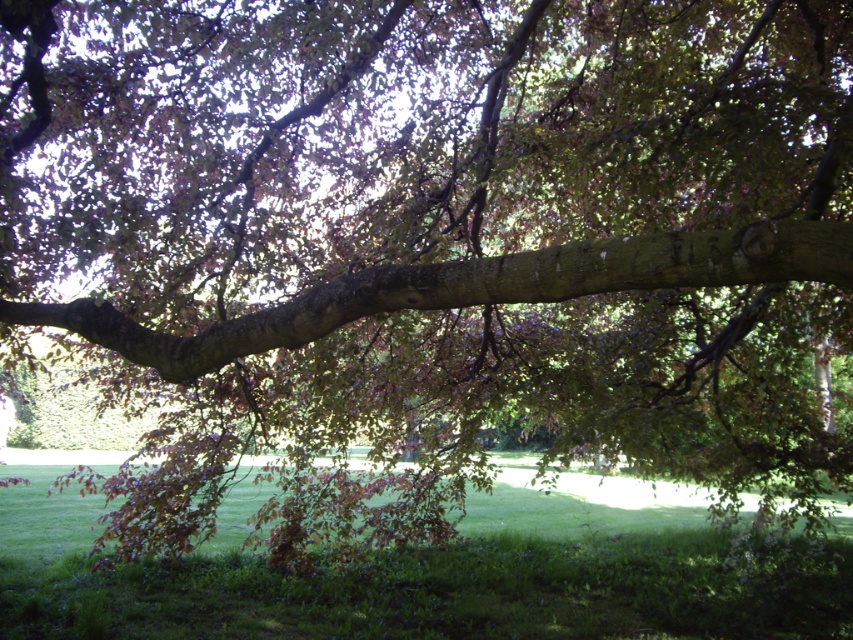
Can you confirm if green grassy at lower center is positioned above smooth brown branch at center?

Incorrect, green grassy at lower center is not positioned above smooth brown branch at center.

Can you confirm if green grassy at lower center is shorter than smooth brown branch at center?

No, green grassy at lower center is not shorter than smooth brown branch at center.

Identify the location of green grassy at lower center. (434, 579).